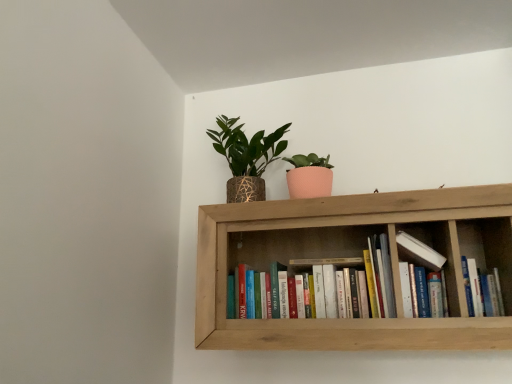
What is the approximate height of hardcover book at center, which is the 1th book in right-to-left order?

The height of hardcover book at center, which is the 1th book in right-to-left order, is 16.11 centimeters.

Image resolution: width=512 pixels, height=384 pixels. Identify the location of textured gold pot at upper center. (246, 157).

This screenshot has height=384, width=512. Find the location of `wooden bookshelf at upper center`. wooden bookshelf at upper center is located at coordinates (355, 256).

Is point (481, 329) closer or farther from the camera than point (495, 288)?

Point (481, 329).

Is wooden bookshelf at upper center behind hardcover book at center, which is the 1th book in right-to-left order?

No, it is in front of hardcover book at center, which is the 1th book in right-to-left order.

Looking at this image, is wooden bookshelf at upper center taller or shorter than hardcover book at center, which is the 1th book in right-to-left order?

wooden bookshelf at upper center is taller than hardcover book at center, which is the 1th book in right-to-left order.

You are a GUI agent. You are given a task and a screenshot of the screen. Output one action in this format:
    pyautogui.click(x=<x>, y=<y>)
    Task: Click on the 2nd book below the wooden bookshelf at upper center (from the image's perspective)
    This screenshot has width=512, height=384.
    Given the screenshot: What is the action you would take?
    pyautogui.click(x=482, y=290)

Does textured gold pot at upper center have a smaller size compared to hardcover book at center, which is the 1th book in right-to-left order?

Actually, textured gold pot at upper center might be larger than hardcover book at center, which is the 1th book in right-to-left order.

Which is nearer, [229,164] or [478,302]?

Point [229,164] is positioned farther from the camera compared to point [478,302].

The width and height of the screenshot is (512, 384). Identify the location of the 1st book in front of the textured gold pot at upper center, starting your count from the anchor. (482, 290).

Which object is positioned more to the right, textured gold pot at upper center or wooden bookshelf at upper center?

wooden bookshelf at upper center.

Is textured gold pot at upper center closer to camera compared to wooden bookshelf at upper center?

No, textured gold pot at upper center is behind wooden bookshelf at upper center.

Consider the image. Is textured gold pot at upper center facing towards wooden bookshelf at upper center?

No, textured gold pot at upper center is not turned towards wooden bookshelf at upper center.

Considering the positions of objects hardcover books at center, the second book from the right, and textured gold pot at upper center in the image provided, who is in front, hardcover books at center, the second book from the right, or textured gold pot at upper center?

hardcover books at center, the second book from the right.

From the image's perspective, would you say hardcover books at center, which appears as the 1th book when viewed from the left, is positioned over textured gold pot at upper center?

No, from the image's perspective, hardcover books at center, which appears as the 1th book when viewed from the left, is not above textured gold pot at upper center.

From a real-world perspective, which object stands above the other?

In real-world perspective, textured gold pot at upper center is above.

Who is taller, hardcover books at center, which appears as the 1th book when viewed from the left, or wooden bookshelf at upper center?

With more height is wooden bookshelf at upper center.

Considering the points (505, 288) and (393, 250), which point is behind, point (505, 288) or point (393, 250)?

Point (505, 288)

Based on the photo, from a real-world perspective, who is located lower, hardcover books at center, which appears as the 1th book when viewed from the left, or wooden bookshelf at upper center?

hardcover books at center, which appears as the 1th book when viewed from the left.

From the picture: Are hardcover books at center, the second book from the right, and wooden bookshelf at upper center far apart?

They are positioned close to each other.

Which object is closer to the camera taking this photo, wooden bookshelf at upper center or hardcover books at center, the second book from the right?

wooden bookshelf at upper center.

From the image's perspective, is wooden bookshelf at upper center above hardcover books at center, which appears as the 1th book when viewed from the left?

Yes, from the image's perspective, wooden bookshelf at upper center is on top of hardcover books at center, which appears as the 1th book when viewed from the left.

Is point (353, 344) farther from viewer compared to point (448, 275)?

No, it is not.

Is wooden bookshelf at upper center facing towards hardcover books at center, which appears as the 1th book when viewed from the left?

Yes, wooden bookshelf at upper center is turned towards hardcover books at center, which appears as the 1th book when viewed from the left.

Looking at this image, which object is further away from the camera, textured gold pot at upper center or hardcover books at center, which appears as the 1th book when viewed from the left?

textured gold pot at upper center is behind.

From the image's perspective, between textured gold pot at upper center and hardcover books at center, the second book from the right, who is located below?

hardcover books at center, the second book from the right.

From a real-world perspective, is textured gold pot at upper center positioned above or below hardcover books at center, which appears as the 1th book when viewed from the left?

textured gold pot at upper center is above hardcover books at center, which appears as the 1th book when viewed from the left.

Locate an element on the screen. shelf on the left of hardcover book at center, which is the 1th book in right-to-left order is located at coordinates (355, 256).

From a real-world perspective, starting from the textured gold pot at upper center, which book is the 2nd one below it? Please provide its 2D coordinates.

[(482, 290)]

From the image, which object appears to be nearer to textured gold pot at upper center, hardcover book at center, positioned as the 2th book in left-to-right order, or wooden bookshelf at upper center?

The object closer to textured gold pot at upper center is wooden bookshelf at upper center.

Looking at the image, which one is located closer to hardcover books at center, the second book from the right, wooden bookshelf at upper center or textured gold pot at upper center?

The object closer to hardcover books at center, the second book from the right, is wooden bookshelf at upper center.

Looking at this image, estimate the real-world distances between objects in this image. Which object is closer to wooden bookshelf at upper center, hardcover book at center, which is the 1th book in right-to-left order, or textured gold pot at upper center?

Based on the image, hardcover book at center, which is the 1th book in right-to-left order, appears to be nearer to wooden bookshelf at upper center.

Which object lies further to the anchor point hardcover book at center, which is the 1th book in right-to-left order, hardcover books at center, the second book from the right, or wooden bookshelf at upper center?

wooden bookshelf at upper center lies further to hardcover book at center, which is the 1th book in right-to-left order, than the other object.

Looking at the image, which one is located further to hardcover book at center, which is the 1th book in right-to-left order, textured gold pot at upper center or wooden bookshelf at upper center?

textured gold pot at upper center.

Which object lies nearer to the anchor point textured gold pot at upper center, hardcover books at center, the second book from the right, or wooden bookshelf at upper center?

wooden bookshelf at upper center is positioned closer to the anchor textured gold pot at upper center.

Which object lies further to the anchor point hardcover books at center, which appears as the 1th book when viewed from the left, textured gold pot at upper center or hardcover book at center, which is the 1th book in right-to-left order?

Based on the image, textured gold pot at upper center appears to be further to hardcover books at center, which appears as the 1th book when viewed from the left.

Estimate the real-world distances between objects in this image. Which object is closer to hardcover book at center, which is the 1th book in right-to-left order, wooden bookshelf at upper center or hardcover books at center, which appears as the 1th book when viewed from the left?

Based on the image, hardcover books at center, which appears as the 1th book when viewed from the left, appears to be nearer to hardcover book at center, which is the 1th book in right-to-left order.

I want to click on shelf between textured gold pot at upper center and hardcover book at center, positioned as the 2th book in left-to-right order, from left to right, so click(x=355, y=256).

Identify the location of shelf that lies between textured gold pot at upper center and hardcover books at center, the second book from the right, from top to bottom. This screenshot has height=384, width=512. (355, 256).

Where is `book between textured gold pot at upper center and hardcover book at center, which is the 1th book in right-to-left order`? book between textured gold pot at upper center and hardcover book at center, which is the 1th book in right-to-left order is located at coordinates (316, 252).

The height and width of the screenshot is (384, 512). Identify the location of shelf between hardcover books at center, which appears as the 1th book when viewed from the left, and hardcover book at center, which is the 1th book in right-to-left order. (355, 256).